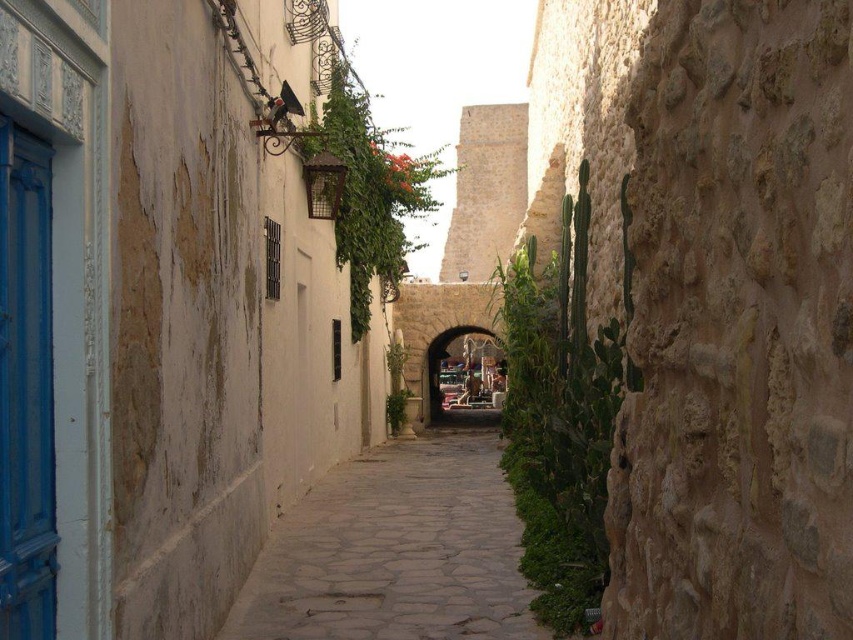
Does pebble stone path at center have a lesser height compared to stone archway at center?

Yes, pebble stone path at center is shorter than stone archway at center.

Between pebble stone path at center and stone archway at center, which one is positioned higher?

stone archway at center is higher up.

Where is `pebble stone path at center`? pebble stone path at center is located at coordinates (395, 550).